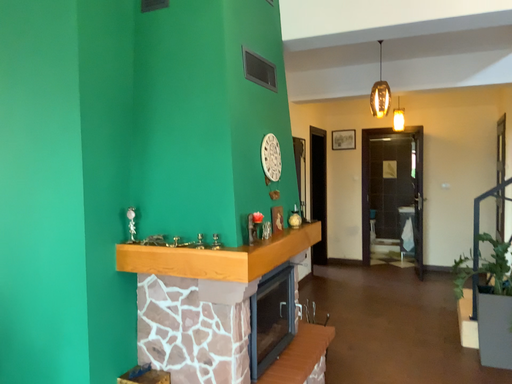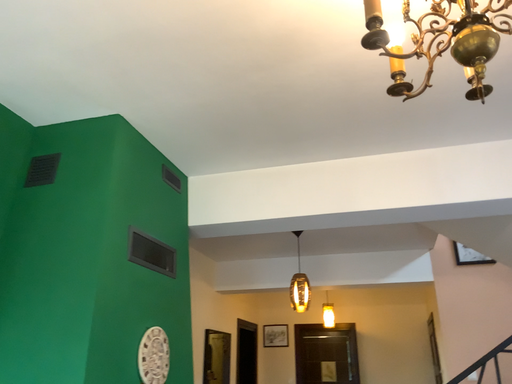
Question: How did the camera likely rotate when shooting the video?

Choices:
 (A) rotated left
 (B) rotated right

Answer: (B)